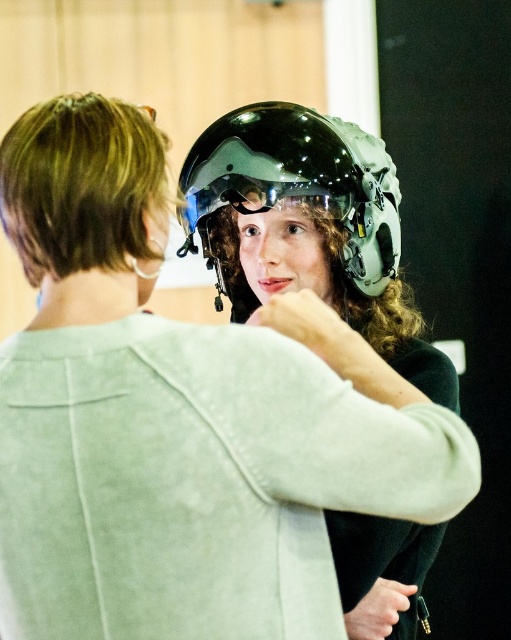
Question: Which is nearer to the matte black helmet at center?

Choices:
 (A) transparent plastic goggles at center
 (B) glossy black helmet at center

Answer: (B)

Question: Can you confirm if matte black helmet at center is bigger than transparent plastic goggles at center?

Choices:
 (A) no
 (B) yes

Answer: (B)

Question: Does glossy black helmet at center appear under transparent plastic goggles at center?

Choices:
 (A) no
 (B) yes

Answer: (B)

Question: Is matte black helmet at center above transparent plastic goggles at center?

Choices:
 (A) no
 (B) yes

Answer: (A)

Question: Considering the real-world distances, which object is closest to the transparent plastic goggles at center?

Choices:
 (A) matte black helmet at center
 (B) glossy black helmet at center

Answer: (A)

Question: Among these points, which one is nearest to the camera?

Choices:
 (A) (379, 272)
 (B) (328, 208)

Answer: (B)